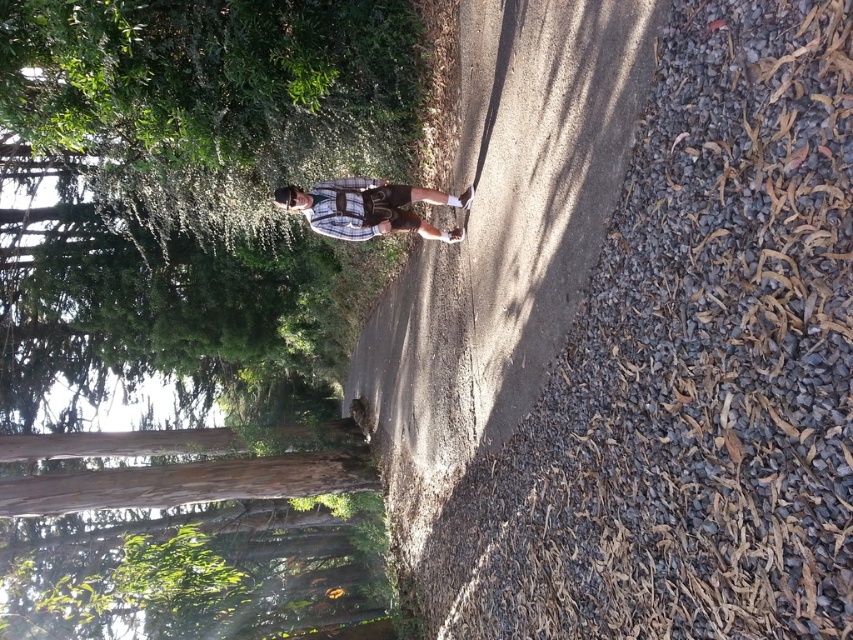
Describe the element at coordinates (192, 196) in the screenshot. I see `green leafy tree at center` at that location.

Does green leafy tree at center have a lesser width compared to plaid fabric shirt at center?

No.

Where is `green leafy tree at center`? green leafy tree at center is located at coordinates (192, 196).

Locate an element on the screen. The width and height of the screenshot is (853, 640). green leafy tree at center is located at coordinates (192, 196).